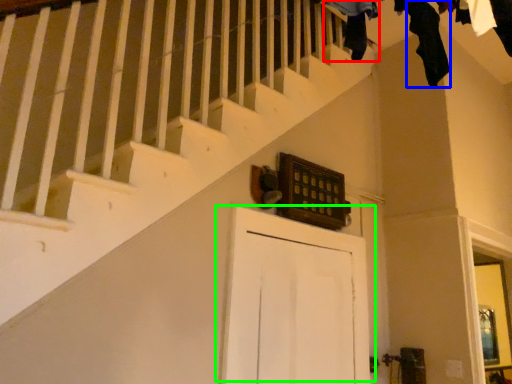
Question: Considering the real-world distances, which object is closest to clothing (highlighted by a red box)? clothing (highlighted by a blue box) or door (highlighted by a green box).

Choices:
 (A) clothing
 (B) door

Answer: (A)